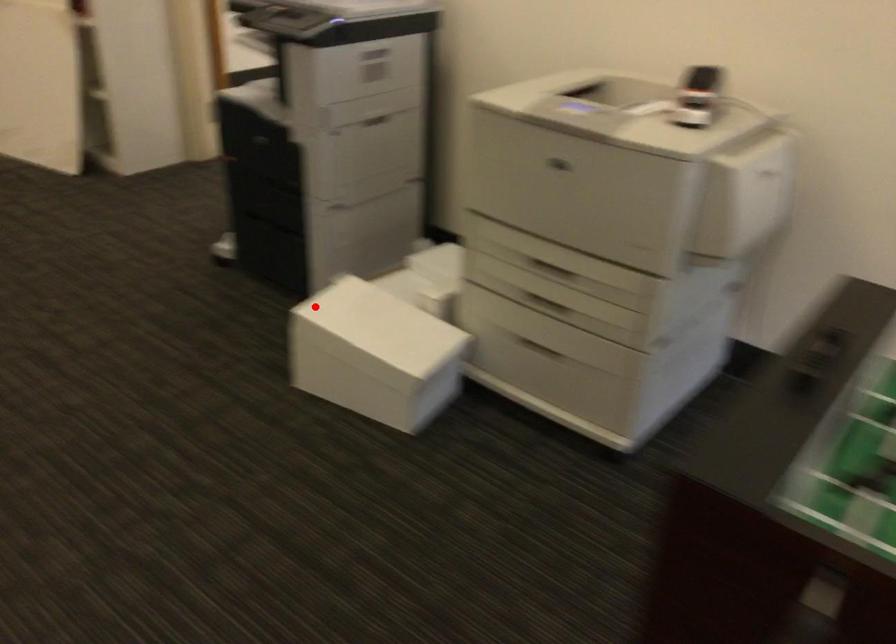
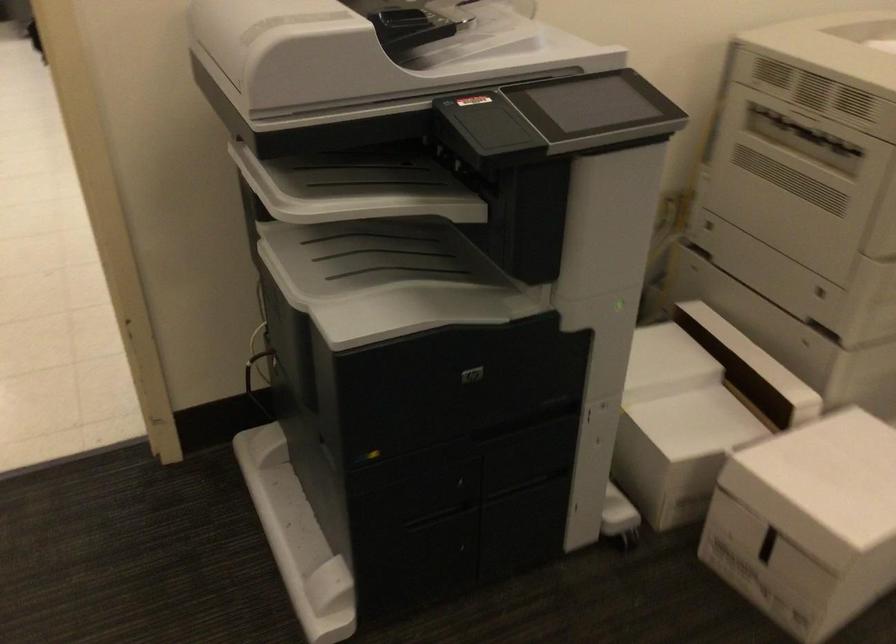
Where in the second image is the point corresponding to the highlighted location from the first image?

(807, 522)